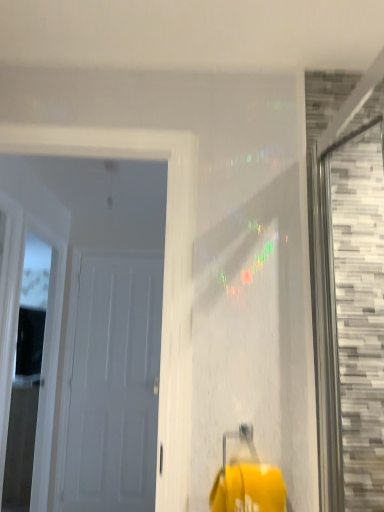
Question: Is white matte door at left, the 1th door in the front-to-back sequence, taller than gray mosaic tile at right, which ranks as the second window in back-to-front order?

Choices:
 (A) no
 (B) yes

Answer: (B)

Question: Does white matte door at left, the 1th door in the front-to-back sequence, have a greater width compared to gray mosaic tile at right, which is counted as the 2th window, starting from the left?

Choices:
 (A) no
 (B) yes

Answer: (A)

Question: From the image's perspective, is white matte door at left, acting as the 2th door starting from the back, over gray mosaic tile at right, which ranks as the second window in back-to-front order?

Choices:
 (A) no
 (B) yes

Answer: (A)

Question: Is white matte door at left, acting as the 2th door starting from the back, to the right of gray mosaic tile at right, marked as the first window in a right-to-left arrangement, from the viewer's perspective?

Choices:
 (A) no
 (B) yes

Answer: (A)

Question: Is white matte door at left, the 1th door in the front-to-back sequence, at the left side of gray mosaic tile at right, arranged as the first window when viewed from the front?

Choices:
 (A) no
 (B) yes

Answer: (B)

Question: From a real-world perspective, is white matte door at left, the 1th door in the front-to-back sequence, physically above gray mosaic tile at right, which is counted as the 2th window, starting from the left?

Choices:
 (A) no
 (B) yes

Answer: (B)

Question: From a real-world perspective, is white matte door at left, the 1th door in the back-to-front sequence, under white wood door at left, placed as the second window when sorted from right to left?

Choices:
 (A) yes
 (B) no

Answer: (A)

Question: Is white matte door at left, the 1th door in the back-to-front sequence, shorter than white wood door at left, the second window positioned from the front?

Choices:
 (A) yes
 (B) no

Answer: (A)

Question: Is white matte door at left, the 1th door in the back-to-front sequence, at the right side of white wood door at left, which is the 1th window in back-to-front order?

Choices:
 (A) yes
 (B) no

Answer: (A)

Question: Is white matte door at left, the 1th door in the back-to-front sequence, smaller than white wood door at left, the first window positioned from the left?

Choices:
 (A) yes
 (B) no

Answer: (A)

Question: Is white wood door at left, which is the 1th window in back-to-front order, completely or partially inside white matte door at left, the second door in the front-to-back sequence?

Choices:
 (A) yes
 (B) no

Answer: (B)

Question: Does white matte door at left, the second door in the front-to-back sequence, have a greater height compared to white wood door at left, the first window positioned from the left?

Choices:
 (A) no
 (B) yes

Answer: (A)